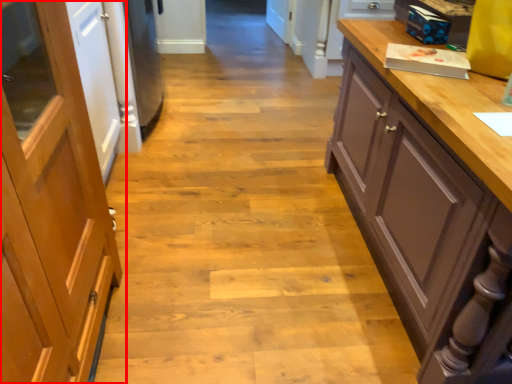
Question: In this image, where is cabinetry (annotated by the red box) located relative to cupboard?

Choices:
 (A) left
 (B) right

Answer: (A)